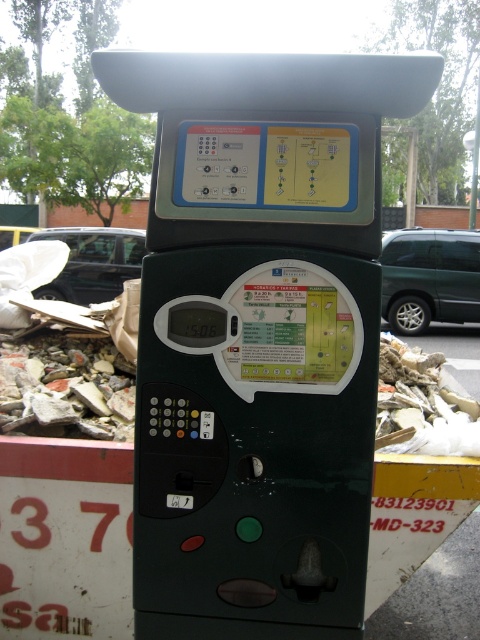
Can you confirm if green matte parking meter at center is positioned above green matte van at right?

No.

What do you see at coordinates (259, 337) in the screenshot? The width and height of the screenshot is (480, 640). I see `green matte parking meter at center` at bounding box center [259, 337].

Is point (166, 317) positioned before point (391, 298)?

Yes, it is.

The height and width of the screenshot is (640, 480). What are the coordinates of `green matte parking meter at center` in the screenshot? It's located at (259, 337).

Measure the distance between green matte van at right and metallic silver car at left.

They are 19.06 feet apart.

Does point (412, 230) lie behind point (120, 268)?

Yes, it is.

Is point (389, 312) positioned behind point (97, 252)?

No, (389, 312) is closer to viewer.

The image size is (480, 640). I want to click on green matte van at right, so click(430, 276).

Who is higher up, green matte parking meter at center or metallic silver car at left?

Positioned higher is metallic silver car at left.

Who is positioned more to the left, green matte parking meter at center or metallic silver car at left?

metallic silver car at left

Does point (220, 134) come in front of point (129, 268)?

Yes, it is.

Where is `green matte parking meter at center`? Image resolution: width=480 pixels, height=640 pixels. green matte parking meter at center is located at coordinates (259, 337).